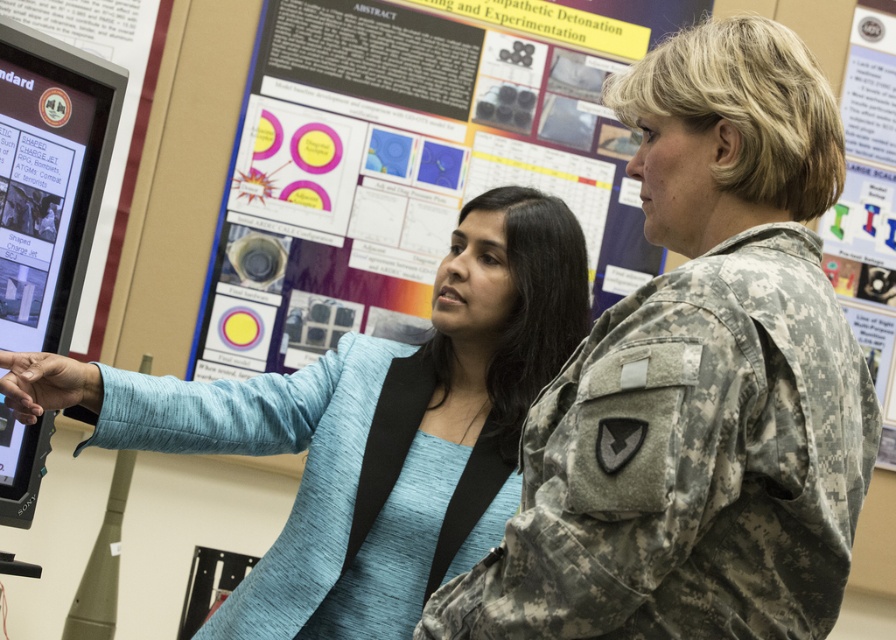
Does matte black monitor at left lie behind matte paper poster at upper right?

No, it is not.

The width and height of the screenshot is (896, 640). Describe the element at coordinates (49, 179) in the screenshot. I see `matte black monitor at left` at that location.

Which is in front, point (24, 168) or point (851, 36)?

Positioned in front is point (24, 168).

The image size is (896, 640). I want to click on matte black monitor at left, so click(49, 179).

Which is in front, point (636, 497) or point (93, 180)?

Point (636, 497) is in front.

Between camouflage uniform at center and matte black monitor at left, which one is positioned lower?

Positioned lower is camouflage uniform at center.

Between point (634, 369) and point (80, 177), which one is positioned in front?

Point (634, 369)

In order to click on camouflage uniform at center in this screenshot , I will do `click(698, 381)`.

Does point (515, 632) lie in front of point (403, 547)?

That is True.

Is camouflage uniform at center to the right of blue fabric jacket at center from the viewer's perspective?

Correct, you'll find camouflage uniform at center to the right of blue fabric jacket at center.

Who is more distant from viewer, (x=725, y=205) or (x=272, y=604)?

Point (x=272, y=604)

You are a GUI agent. You are given a task and a screenshot of the screen. Output one action in this format:
    pyautogui.click(x=<x>, y=<y>)
    Task: Click on the camouflage uniform at center
    The image size is (896, 640).
    Given the screenshot: What is the action you would take?
    pyautogui.click(x=698, y=381)